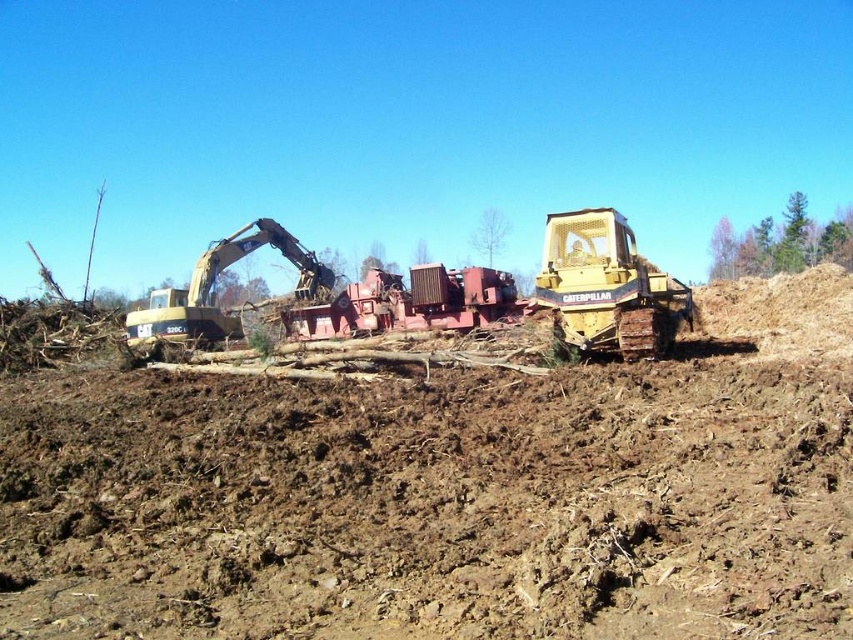
You are a construction worker who needs to move a heavy load from the gold metallic excavator at left to the yellow metallic tractor at center. Which direction should you move the load to reach the tractor?

You should move the load to the right because the yellow metallic tractor at center is located to the right of the gold metallic excavator at left.

You are a construction worker who needs to move the yellow metallic tractor at center to a different location. Considering the brown soil at center is in the way, can you drive the tractor over it easily?

The brown soil at center has a larger size compared to yellow metallic tractor at center, so the tractor may have difficulty driving over the brown soil at center due to its size and the loose, disturbed nature of the soil.

You are a construction worker standing on the yellow metallic tractor at center. You need to move to the gold metallic excavator at left to operate it. Is the tractor blocking your path to the excavator?

The yellow metallic tractor at center is positioned over the gold metallic excavator at left, so the tractor is blocking your path to the excavator.